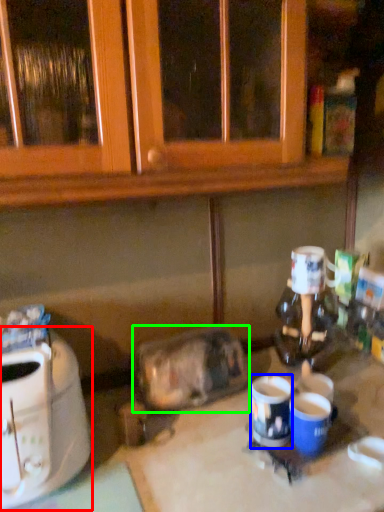
Question: Which is nearer to the toaster (highlighted by a red box)? coffee cup (highlighted by a blue box) or appliance (highlighted by a green box).

Choices:
 (A) coffee cup
 (B) appliance

Answer: (B)